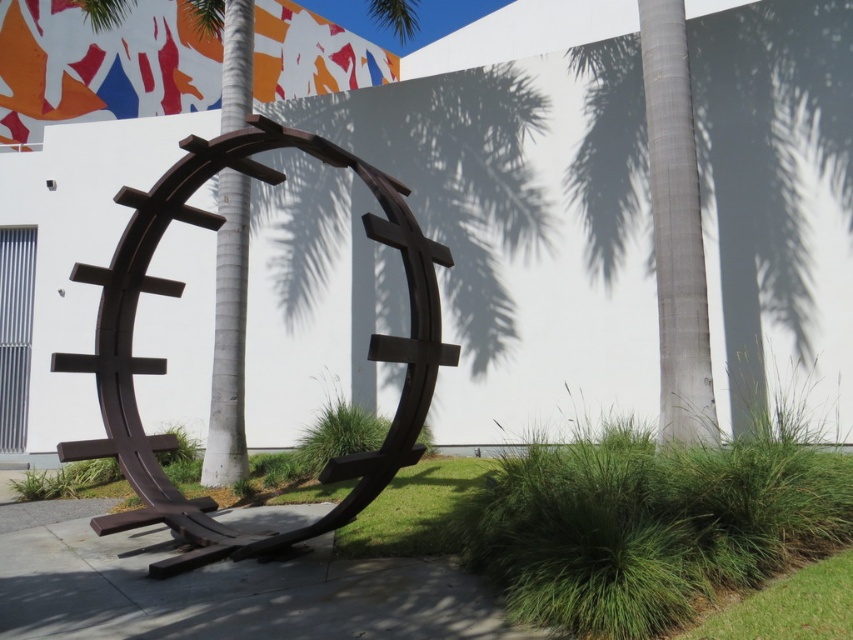
Question: Can you confirm if smooth gray palm tree at right is positioned to the left of brown metal sculpture at center?

Choices:
 (A) yes
 (B) no

Answer: (B)

Question: Can you confirm if smooth gray palm tree at right is thinner than brown metal sculpture at center?

Choices:
 (A) yes
 (B) no

Answer: (A)

Question: Which of the following is the farthest from the observer?

Choices:
 (A) smooth gray palm tree at right
 (B) brown metal sculpture at center

Answer: (A)

Question: Is smooth gray palm tree at right wider than brown metal sculpture at center?

Choices:
 (A) yes
 (B) no

Answer: (B)